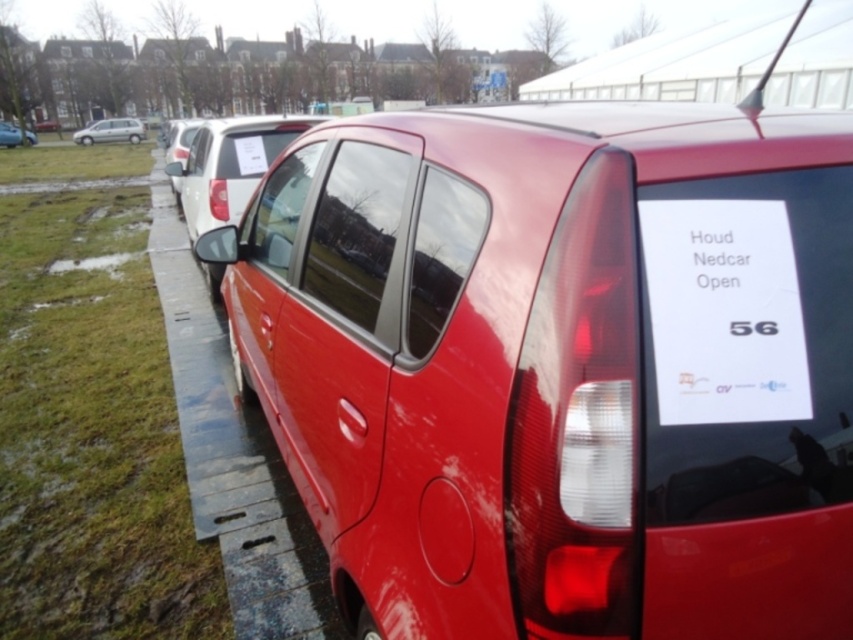
Does glossy white van at center appear over silver metallic van at upper left?

Actually, glossy white van at center is below silver metallic van at upper left.

In the scene shown: Who is shorter, glossy white van at center or silver metallic van at upper left?

silver metallic van at upper left

Locate an element on the screen. glossy white van at center is located at coordinates (229, 164).

Between metal curb at lower left and silver metallic van at upper left, which one is positioned lower?

metal curb at lower left is lower down.

Is metal curb at lower left closer to the viewer compared to silver metallic van at upper left?

Yes, it is in front of silver metallic van at upper left.

Does point (305, 634) lie behind point (91, 134)?

No, it is in front of (91, 134).

In order to click on metal curb at lower left in this screenshot , I will do `click(233, 456)`.

Who is more forward, (108,136) or (15,141)?

Point (15,141) is more forward.

At what (x,y) coordinates should I click in order to perform the action: click on silver metallic van at upper left. Please return your answer as a coordinate pair (x, y). Looking at the image, I should click on (111, 131).